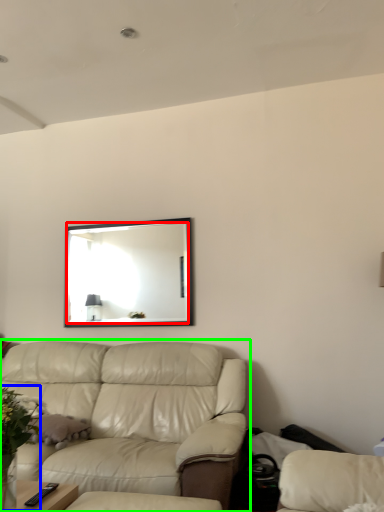
Question: Considering the real-world distances, which object is farthest from mirror (highlighted by a red box)? floral arrangement (highlighted by a blue box) or studio couch (highlighted by a green box)?

Choices:
 (A) floral arrangement
 (B) studio couch

Answer: (A)